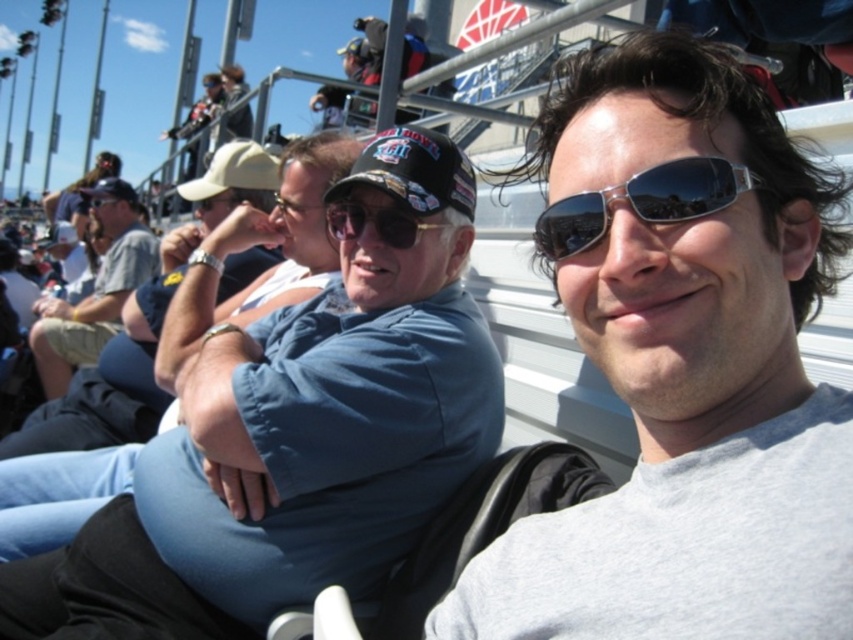
You are a photographer at the event and want to capture a photo where both the blue fabric shirt at center and the matte black goggles at upper center are clearly visible. Based on their positions, which object should you focus on first to ensure both are in frame?

The blue fabric shirt at center is located below the matte black goggles at upper center, so focusing on the matte black goggles at upper center first will help ensure both are in frame as the shirt is positioned lower.

You are a photographer at the event and want to capture a photo that includes both the gray matte shirt at center and the matte black goggles at upper center. Based on their positions, which object should you focus on first to ensure both are in frame?

The gray matte shirt at center is below matte black goggles at upper center, so you should focus on the matte black goggles at upper center first to ensure both are in frame.